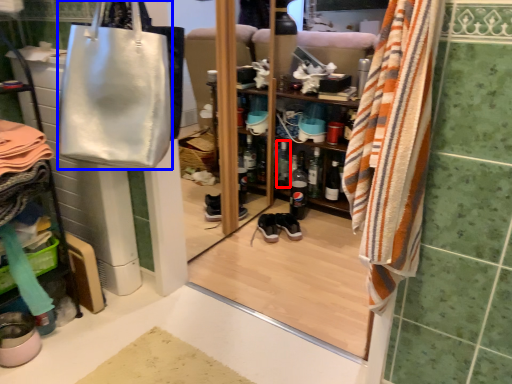
Question: Which object is closer to the camera taking this photo, bottle (highlighted by a red box) or handbag (highlighted by a blue box)?

Choices:
 (A) bottle
 (B) handbag

Answer: (B)